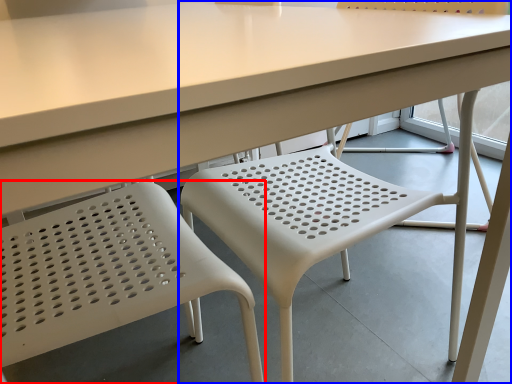
Question: Which point is closer to the camera, chair (highlighted by a red box) or chair (highlighted by a blue box)?

Choices:
 (A) chair
 (B) chair

Answer: (A)